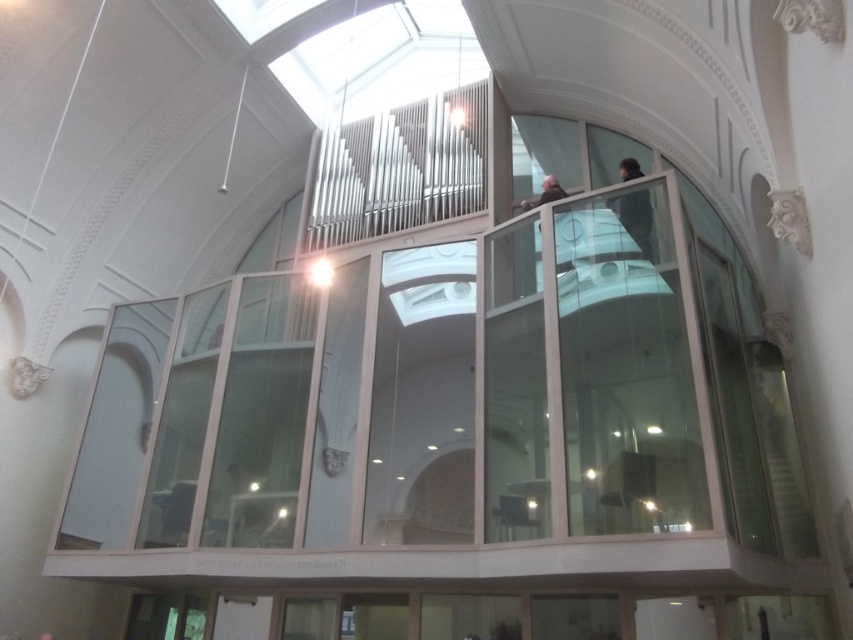
Question: Considering the relative positions of dark gray fabric jacket at upper right and dark brown leather jacket at upper center in the image provided, where is dark gray fabric jacket at upper right located with respect to dark brown leather jacket at upper center?

Choices:
 (A) right
 (B) left

Answer: (A)

Question: Does dark gray fabric jacket at upper right come in front of dark brown leather jacket at upper center?

Choices:
 (A) no
 (B) yes

Answer: (B)

Question: Which point is farther from the camera taking this photo?

Choices:
 (A) (543, 202)
 (B) (624, 172)

Answer: (A)

Question: Among these objects, which one is nearest to the camera?

Choices:
 (A) dark gray fabric jacket at upper right
 (B) dark brown leather jacket at upper center

Answer: (A)

Question: Considering the relative positions of dark gray fabric jacket at upper right and dark brown leather jacket at upper center in the image provided, where is dark gray fabric jacket at upper right located with respect to dark brown leather jacket at upper center?

Choices:
 (A) below
 (B) above

Answer: (A)